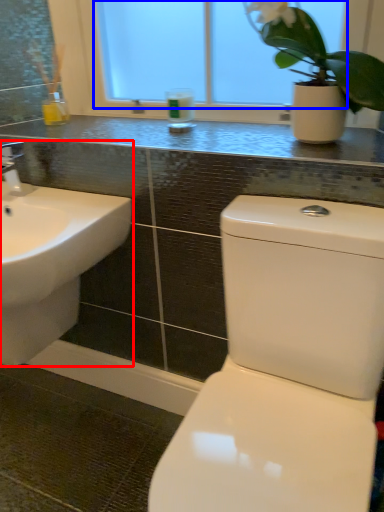
Question: Which object appears farthest to the camera in this image, sink (highlighted by a red box) or window screen (highlighted by a blue box)?

Choices:
 (A) sink
 (B) window screen

Answer: (B)